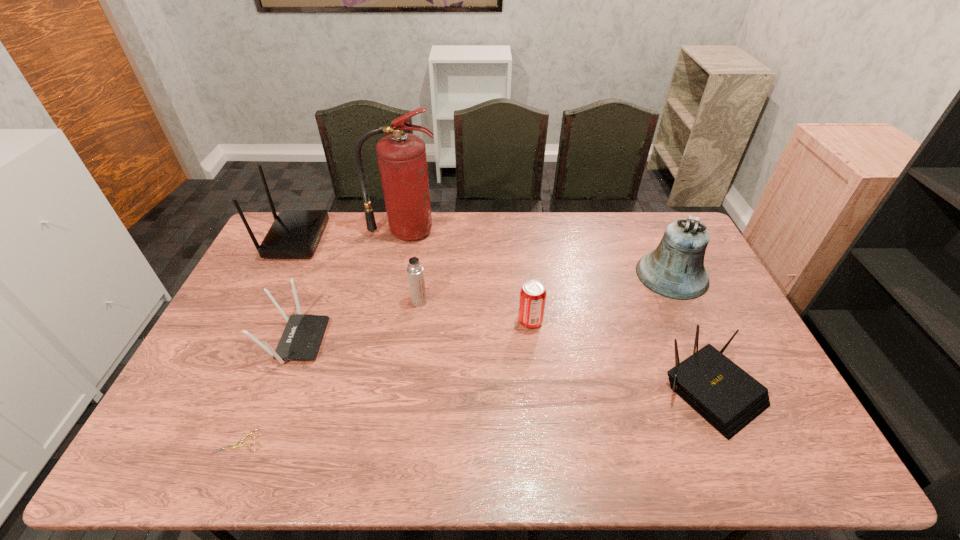
Identify the location of fire extinguisher. (402, 161).

The image size is (960, 540). What are the coordinates of `the tallest router` in the screenshot? It's located at (295, 233).

You are a GUI agent. You are given a task and a screenshot of the screen. Output one action in this format:
    pyautogui.click(x=<x>, y=<y>)
    Task: Click on the bell
    The height and width of the screenshot is (540, 960).
    Given the screenshot: What is the action you would take?
    [x=675, y=269]

At what (x,y) coordinates should I click in order to perform the action: click on the fourth tallest object. Please return your answer as a coordinate pair (x, y). Looking at the image, I should click on (415, 271).

Locate an element on the screen. Image resolution: width=960 pixels, height=540 pixels. the third object from right to left is located at coordinates click(532, 300).

Identify the location of the second tallest router. (301, 339).

The height and width of the screenshot is (540, 960). I want to click on the seventh tallest object, so pyautogui.click(x=726, y=396).

The image size is (960, 540). I want to click on the shortest router, so click(x=726, y=396).

Where is `the shortest object`? The width and height of the screenshot is (960, 540). the shortest object is located at coordinates (238, 444).

Find the location of a particular element. free space located at the front of the fire extinguisher where the nozzle is aimed is located at coordinates (395, 276).